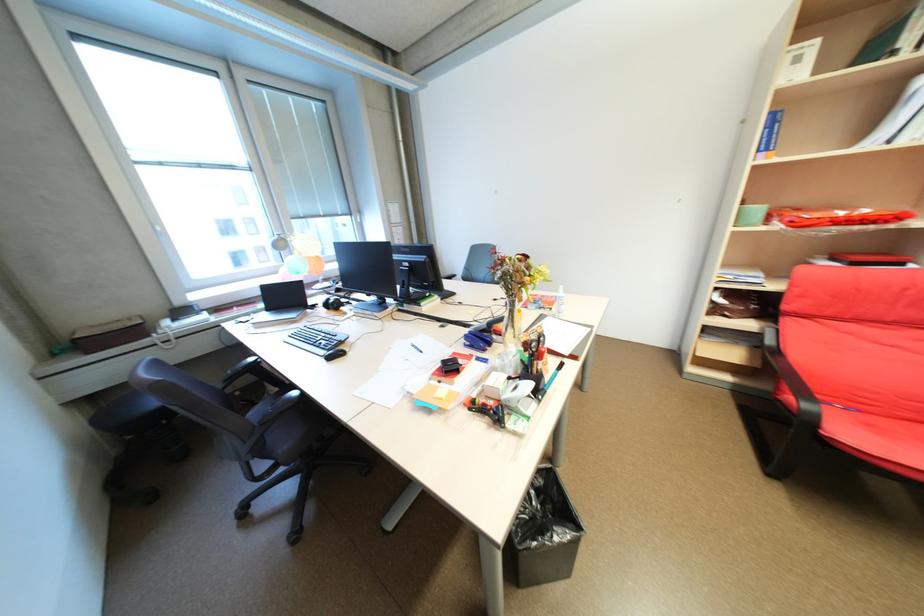
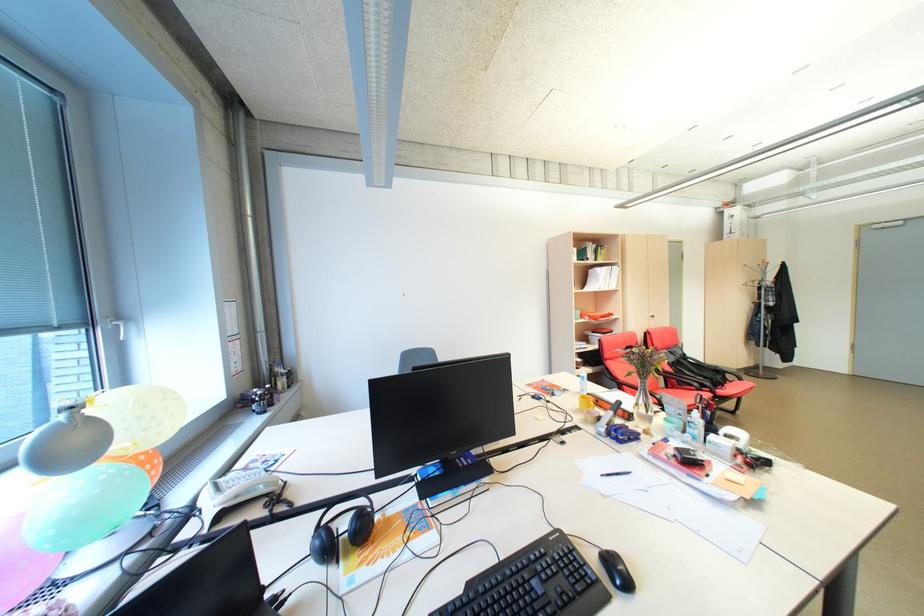
In the second image, find the point that corresponds to point (365, 220) in the first image.

(122, 334)